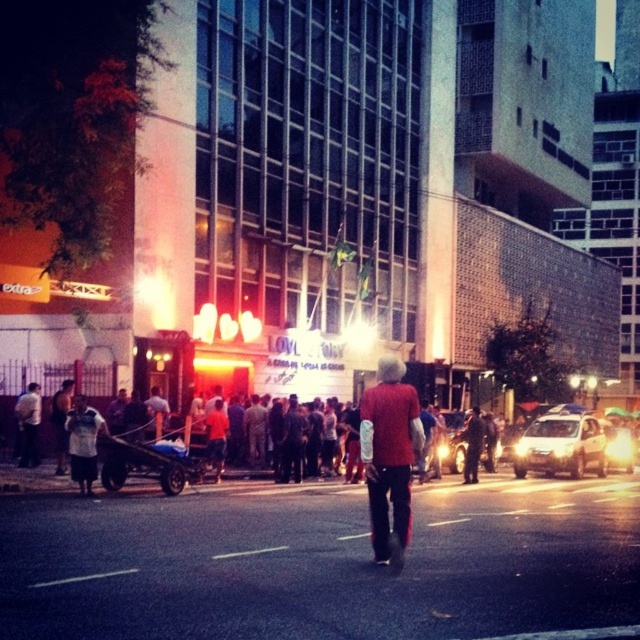
Does silver metallic sedan at center have a smaller size compared to shiny silver sedan at center?

Incorrect, silver metallic sedan at center is not smaller in size than shiny silver sedan at center.

Is silver metallic sedan at center further to the viewer compared to shiny silver sedan at center?

No, silver metallic sedan at center is closer to the viewer.

Between point (550, 470) and point (492, 429), which one is positioned behind?

Positioned behind is point (492, 429).

Where is `silver metallic sedan at center`? silver metallic sedan at center is located at coordinates (561, 445).

Which is below, matte red sweater at center or silver metallic sedan at center?

Positioned lower is silver metallic sedan at center.

Does matte red sweater at center lie behind silver metallic sedan at center?

That is False.

Locate an element on the screen. matte red sweater at center is located at coordinates (388, 456).

Identify the location of matte red sweater at center. The image size is (640, 640). (388, 456).

Who is higher up, silver metallic sedan at center or white cotton shirt at lower left?

white cotton shirt at lower left is higher up.

Is silver metallic sedan at center positioned in front of white cotton shirt at lower left?

No, silver metallic sedan at center is further to the viewer.

Does point (602, 432) lie behind point (106, 433)?

Yes, point (602, 432) is behind point (106, 433).

I want to click on silver metallic sedan at center, so click(561, 445).